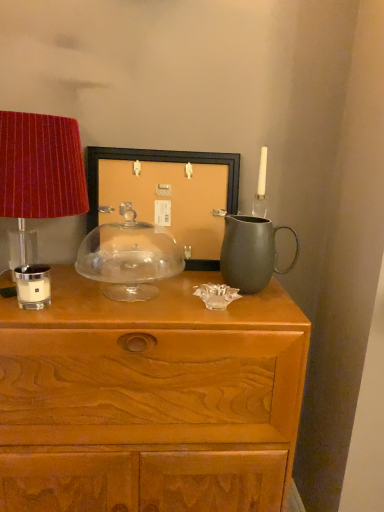
In order to face matte black picture frame at center, should I rotate leftwards or rightwards?

To align with it, rotate left about 3.819°.

What do you see at coordinates (251, 253) in the screenshot?
I see `matte gray jug at right` at bounding box center [251, 253].

Where is `matte black picture frame at center`? The image size is (384, 512). matte black picture frame at center is located at coordinates (172, 187).

Considering the positions of points (272, 244) and (209, 264), is point (272, 244) farther from camera compared to point (209, 264)?

No, (272, 244) is closer to viewer.

Locate an element on the screen. jug in front of the matte black picture frame at center is located at coordinates (251, 253).

From a real-world perspective, relative to matte black picture frame at center, is matte gray jug at right vertically above or below?

Clearly, from a real-world perspective, matte gray jug at right is below matte black picture frame at center.

Which is more to the left, matte gray jug at right or matte black picture frame at center?

matte black picture frame at center.

Looking at this image, is white matte candle holder at left, which is the 1th candle holder from left to right, oriented away from matte black picture frame at center?

No, white matte candle holder at left, which is the 1th candle holder from left to right,'s orientation is not away from matte black picture frame at center.

Is white matte candle holder at left, marked as the 2th candle holder in a back-to-front arrangement, not near matte black picture frame at center?

That's not correct — white matte candle holder at left, marked as the 2th candle holder in a back-to-front arrangement, is a little close to matte black picture frame at center.

From the image's perspective, is white matte candle holder at left, which is the 1th candle holder in front-to-back order, below matte black picture frame at center?

Yes, from the image's perspective, white matte candle holder at left, which is the 1th candle holder in front-to-back order, is below matte black picture frame at center.

Can you confirm if white matte candle holder at left, which is the 2th candle holder from right to left, is positioned to the right of matte black picture frame at center?

Incorrect, white matte candle holder at left, which is the 2th candle holder from right to left, is not on the right side of matte black picture frame at center.

Which is behind, wooden chest of drawers at center or matte gray jug at right?

matte gray jug at right is behind.

Can we say wooden chest of drawers at center lies outside matte gray jug at right?

Absolutely, wooden chest of drawers at center is external to matte gray jug at right.

From the image's perspective, is wooden chest of drawers at center located above or below matte gray jug at right?

From the image's perspective, wooden chest of drawers at center appears below matte gray jug at right.

Considering the sizes of wooden chest of drawers at center and matte gray jug at right in the image, is wooden chest of drawers at center wider or thinner than matte gray jug at right?

In the image, wooden chest of drawers at center appears to be wider than matte gray jug at right.

From the image's perspective, would you say matte black picture frame at center is shown under transparent glass cake stand at center, arranged as the second candle holder when viewed from the left?

No, from the image's perspective, matte black picture frame at center is not below transparent glass cake stand at center, arranged as the second candle holder when viewed from the left.

Identify the location of picture frame located above the transparent glass cake stand at center, placed as the second candle holder when sorted from front to back (from the image's perspective). The width and height of the screenshot is (384, 512). (172, 187).

Considering the points (208, 186) and (129, 216), which point is in front, point (208, 186) or point (129, 216)?

Positioned in front is point (129, 216).

In the scene shown: Is transparent glass cake stand at center, placed as the second candle holder when sorted from front to back, positioned beyond the bounds of matte gray jug at right?

Indeed, transparent glass cake stand at center, placed as the second candle holder when sorted from front to back, is completely outside matte gray jug at right.

From the picture: Is transparent glass cake stand at center, arranged as the second candle holder when viewed from the left, taller or shorter than matte gray jug at right?

Considering their sizes, transparent glass cake stand at center, arranged as the second candle holder when viewed from the left, has more height than matte gray jug at right.

What are the coordinates of `jug located above the transparent glass cake stand at center, which is the 1th candle holder from right to left (from a real-world perspective)` in the screenshot? It's located at (251, 253).

How far apart are transparent glass cake stand at center, which is the 1th candle holder from back to front, and matte gray jug at right?

transparent glass cake stand at center, which is the 1th candle holder from back to front, and matte gray jug at right are 11.07 inches apart from each other.

In the scene shown: Which is correct: white matte candle holder at left, which is the 1th candle holder in front-to-back order, is inside transparent glass cake stand at center, arranged as the second candle holder when viewed from the left, or outside of it?

white matte candle holder at left, which is the 1th candle holder in front-to-back order, cannot be found inside transparent glass cake stand at center, arranged as the second candle holder when viewed from the left.

From the image's perspective, is white matte candle holder at left, which is the 1th candle holder from left to right, below transparent glass cake stand at center, which is the 1th candle holder from right to left?

Yes.

Is matte black picture frame at center to the right of matte gray jug at right from the viewer's perspective?

No.

How different are the orientations of matte black picture frame at center and matte gray jug at right in degrees?

The angle between the facing direction of matte black picture frame at center and the facing direction of matte gray jug at right is 0.599 degrees.

Which of these two, matte black picture frame at center or matte gray jug at right, is bigger?

Bigger between the two is matte black picture frame at center.

Find the location of a particular element. The width and height of the screenshot is (384, 512). picture frame located above the matte gray jug at right (from the image's perspective) is located at coordinates (172, 187).

From a real-world perspective, starting from the matte black picture frame at center, which candle holder is the 2nd one below it? Please provide its 2D coordinates.

[(33, 286)]

Which object lies further to the anchor point matte black picture frame at center, transparent glass cake stand at center, arranged as the second candle holder when viewed from the left, or matte gray jug at right?

Among the two, matte gray jug at right is located further to matte black picture frame at center.

Looking at the image, which one is located closer to wooden chest of drawers at center, velvet red lampshade at left or transparent glass cake stand at center, arranged as the second candle holder when viewed from the left?

Based on the image, transparent glass cake stand at center, arranged as the second candle holder when viewed from the left, appears to be nearer to wooden chest of drawers at center.

Estimate the real-world distances between objects in this image. Which object is closer to velvet red lampshade at left, white matte candle holder at left, which is the 1th candle holder from left to right, or matte gray jug at right?

Among the two, white matte candle holder at left, which is the 1th candle holder from left to right, is located nearer to velvet red lampshade at left.

In the scene shown: Based on their spatial positions, is wooden chest of drawers at center or matte gray jug at right closer to matte black picture frame at center?

The object closer to matte black picture frame at center is matte gray jug at right.

Looking at the image, which one is located further to matte black picture frame at center, white matte candle holder at left, marked as the 2th candle holder in a back-to-front arrangement, or velvet red lampshade at left?

white matte candle holder at left, marked as the 2th candle holder in a back-to-front arrangement, lies further to matte black picture frame at center than the other object.

From the image, which object appears to be nearer to transparent glass cake stand at center, which is the 1th candle holder from back to front, velvet red lampshade at left or white matte candle holder at left, marked as the 2th candle holder in a back-to-front arrangement?

The object closer to transparent glass cake stand at center, which is the 1th candle holder from back to front, is white matte candle holder at left, marked as the 2th candle holder in a back-to-front arrangement.

From the image, which object appears to be nearer to matte gray jug at right, velvet red lampshade at left or wooden chest of drawers at center?

Based on the image, wooden chest of drawers at center appears to be nearer to matte gray jug at right.

Consider the image. From the image, which object appears to be farther from velvet red lampshade at left, wooden chest of drawers at center or white matte candle holder at left, which is the 1th candle holder in front-to-back order?

Among the two, wooden chest of drawers at center is located further to velvet red lampshade at left.

Find the location of `candle holder that lies between transparent glass cake stand at center, placed as the second candle holder when sorted from front to back, and wooden chest of drawers at center from top to bottom`. candle holder that lies between transparent glass cake stand at center, placed as the second candle holder when sorted from front to back, and wooden chest of drawers at center from top to bottom is located at coordinates (33, 286).

Image resolution: width=384 pixels, height=512 pixels. Identify the location of jug between velvet red lampshade at left and wooden chest of drawers at center in the up-down direction. (251, 253).

At what (x,y) coordinates should I click in order to perform the action: click on picture frame between velvet red lampshade at left and matte gray jug at right from left to right. Please return your answer as a coordinate pair (x, y). Looking at the image, I should click on (172, 187).

Locate an element on the screen. candle holder that lies between matte gray jug at right and wooden chest of drawers at center from top to bottom is located at coordinates (33, 286).